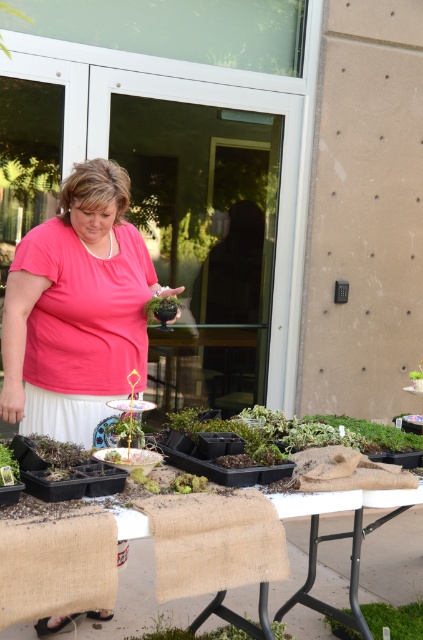
Does pink matte shirt at center have a lesser width compared to green moss at lower left?

In fact, pink matte shirt at center might be wider than green moss at lower left.

Is point (19, 336) farther from camera compared to point (0, 456)?

Yes.

Locate an element on the screen. pink matte shirt at center is located at coordinates (76, 308).

This screenshot has height=640, width=423. Describe the element at coordinates (76, 308) in the screenshot. I see `pink matte shirt at center` at that location.

Can you confirm if pink matte shirt at center is positioned to the left of green mossy plant at lower right?

Correct, you'll find pink matte shirt at center to the left of green mossy plant at lower right.

Which is in front, point (121, 237) or point (387, 611)?

Point (121, 237)

Image resolution: width=423 pixels, height=640 pixels. Identify the location of pink matte shirt at center. (76, 308).

Does green mossy plant at lower right come behind green matte pot at center?

Yes, green mossy plant at lower right is further from the viewer.

Can you confirm if green mossy plant at lower right is shorter than green matte pot at center?

Correct, green mossy plant at lower right is not as tall as green matte pot at center.

What do you see at coordinates (395, 620) in the screenshot? The image size is (423, 640). I see `green mossy plant at lower right` at bounding box center [395, 620].

Locate an element on the screen. This screenshot has width=423, height=640. green mossy plant at lower right is located at coordinates (395, 620).